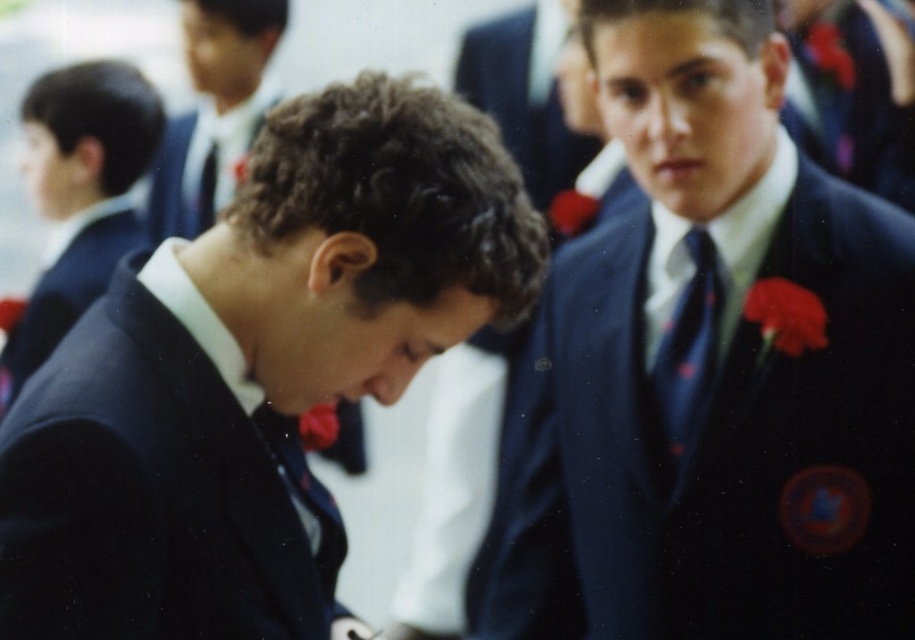
Can you confirm if navy blue suit at lower left is bigger than matte black suit at upper left?

Yes, navy blue suit at lower left is bigger than matte black suit at upper left.

Describe the element at coordinates (158, 483) in the screenshot. I see `navy blue suit at lower left` at that location.

Locate an element on the screen. navy blue suit at lower left is located at coordinates (158, 483).

Is matte black suit at center shorter than navy blue suit at lower left?

No.

Measure the distance between matte black suit at center and camera.

matte black suit at center is 3.75 feet away from camera.

Which is in front, point (375, 224) or point (39, 568)?

Point (39, 568)

Where is `matte black suit at center`? This screenshot has height=640, width=915. matte black suit at center is located at coordinates (254, 372).

Which is behind, point (490, 534) or point (718, 294)?

The point (490, 534) is behind.

Between matte blue suit at center and matte blue tie at center-right, which one appears on the left side from the viewer's perspective?

matte blue suit at center

Does point (601, 596) come in front of point (658, 396)?

No, (601, 596) is further to viewer.

You are a GUI agent. You are given a task and a screenshot of the screen. Output one action in this format:
    pyautogui.click(x=<x>, y=<y>)
    Task: Click on the matte blue suit at center
    The height and width of the screenshot is (640, 915).
    Given the screenshot: What is the action you would take?
    pyautogui.click(x=708, y=378)